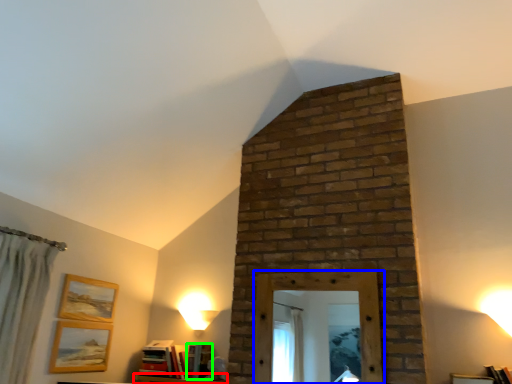
Question: Based on their relative distances, which object is nearer to furniture (highlighted by a red box)? Choose from window frame (highlighted by a blue box) and book (highlighted by a green box).

Choices:
 (A) window frame
 (B) book

Answer: (B)